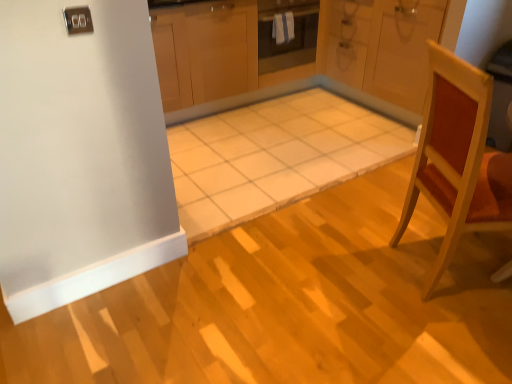
You are a GUI agent. You are given a task and a screenshot of the screen. Output one action in this format:
    pyautogui.click(x=<x>, y=<y>)
    Task: Click on the vacant space in front of wooden chair at right
    The height and width of the screenshot is (384, 512).
    Given the screenshot: What is the action you would take?
    pyautogui.click(x=447, y=339)